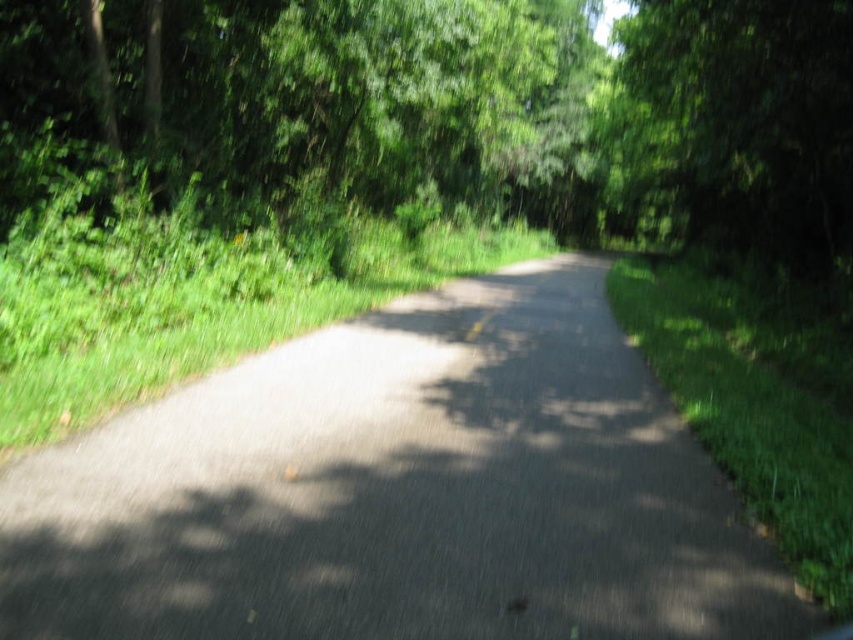
Does green leafy tree at center appear on the left side of green leafy tree at upper right?

Indeed, green leafy tree at center is positioned on the left side of green leafy tree at upper right.

Find the location of a particular element. This screenshot has width=853, height=640. green leafy tree at center is located at coordinates (454, 109).

Identify the location of green leafy tree at center. (x=454, y=109).

Does asphalt road at center have a lesser height compared to green leafy tree at center?

Yes.

Does asphalt road at center come in front of green leafy tree at center?

Yes.

Between point (618, 438) and point (274, 141), which one is positioned in front?

Point (618, 438) is more forward.

You are a GUI agent. You are given a task and a screenshot of the screen. Output one action in this format:
    pyautogui.click(x=<x>, y=<y>)
    Task: Click on the asphalt road at center
    
    Given the screenshot: What is the action you would take?
    pyautogui.click(x=399, y=492)

Does asphalt road at center appear under green leafy tree at upper right?

Yes.

Which of these two, asphalt road at center or green leafy tree at upper right, stands shorter?

asphalt road at center is shorter.

Where is `asphalt road at center`? asphalt road at center is located at coordinates (399, 492).